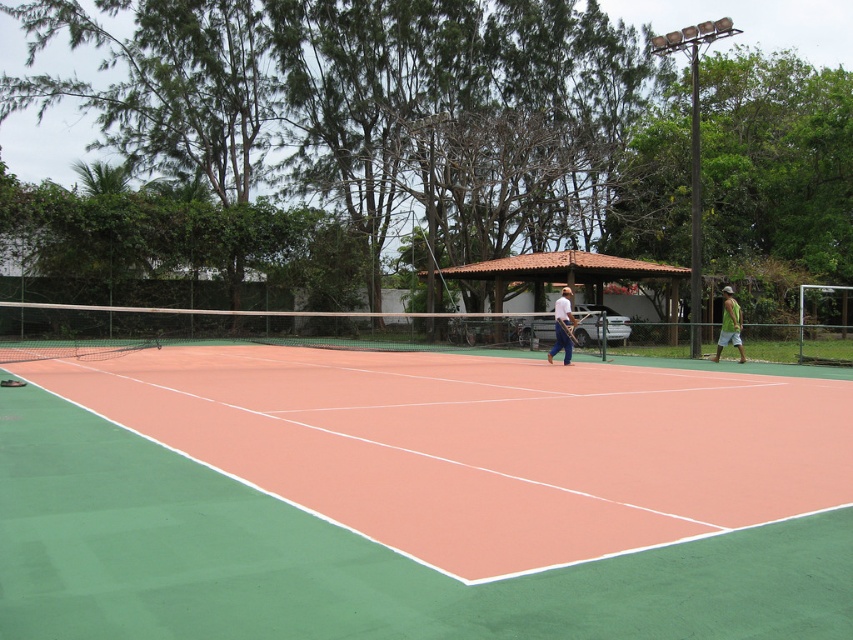
Is white matte tennis racket at center positioned before wooden tennis racket at center?

Yes, it is.

Can you confirm if white matte tennis racket at center is positioned to the left of wooden tennis racket at center?

Yes, white matte tennis racket at center is to the left of wooden tennis racket at center.

Where is `white matte tennis racket at center`? The width and height of the screenshot is (853, 640). white matte tennis racket at center is located at coordinates pyautogui.click(x=563, y=326).

I want to click on white matte tennis racket at center, so click(563, 326).

Which is below, green fabric shorts at right or wooden tennis racket at center?

wooden tennis racket at center is lower down.

Who is positioned more to the right, green fabric shorts at right or wooden tennis racket at center?

green fabric shorts at right

You are a GUI agent. You are given a task and a screenshot of the screen. Output one action in this format:
    pyautogui.click(x=<x>, y=<y>)
    Task: Click on the green fabric shorts at right
    
    Given the screenshot: What is the action you would take?
    pyautogui.click(x=729, y=324)

Which is more to the right, white matte tennis racket at center or green fabric shorts at right?

green fabric shorts at right

Can you confirm if white matte tennis racket at center is positioned below green fabric shorts at right?

Yes, white matte tennis racket at center is below green fabric shorts at right.

Locate an element on the screen. This screenshot has height=640, width=853. white matte tennis racket at center is located at coordinates (563, 326).